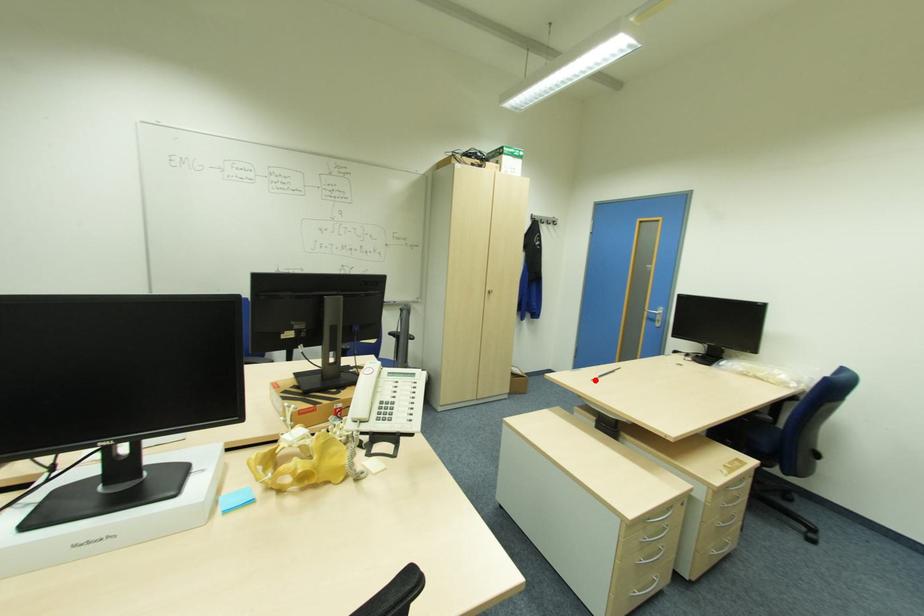
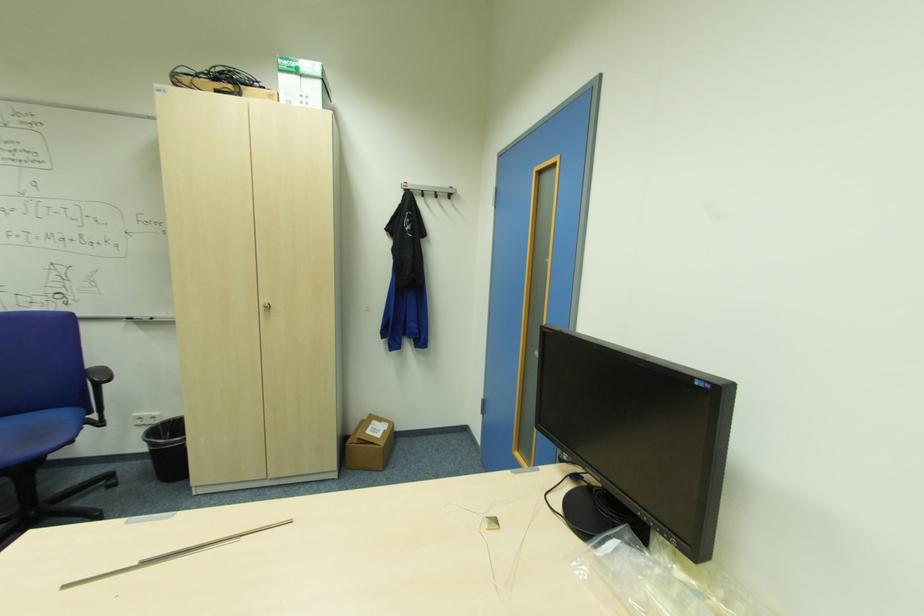
In the second image, find the point that corresponds to the highlighted location in the first image.

(63, 589)